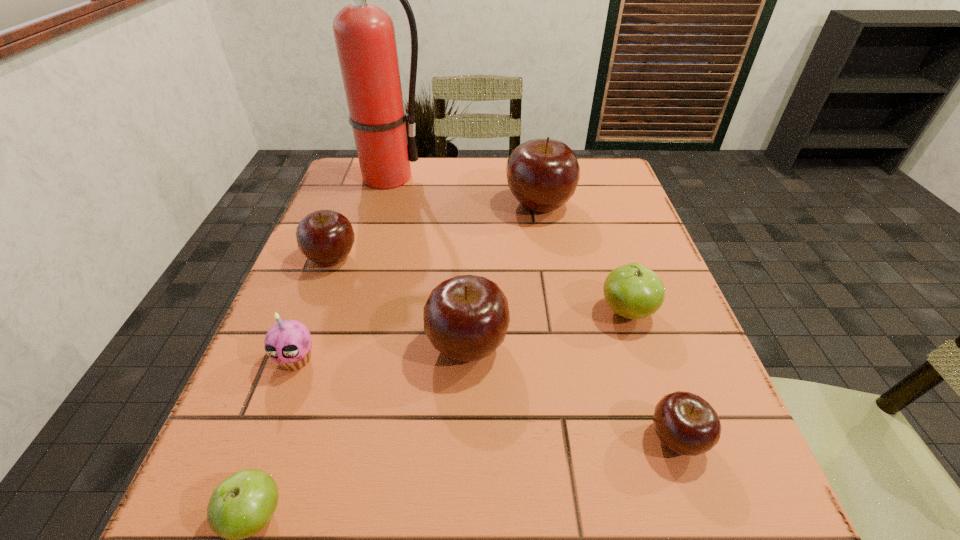
Identify the location of vacant space that satisfies the following two spatial constraints: 1. on the hose direction of the right green apple; 2. on the left side of the fire extinguisher. (345, 312).

You are a GUI agent. You are given a task and a screenshot of the screen. Output one action in this format:
    pyautogui.click(x=<x>, y=<y>)
    Task: Click on the free point that satisfies the following two spatial constraints: 1. on the back side of the farthest red apple; 2. on the right side of the fourth apple from right to left
    This screenshot has height=540, width=960.
    Given the screenshot: What is the action you would take?
    pyautogui.click(x=471, y=205)